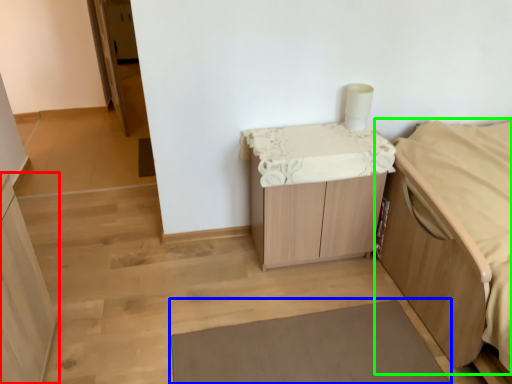
Question: Which object is the farthest from cabinetry (highlighted by a red box)? Choose among these: bath mat (highlighted by a blue box) or furniture (highlighted by a green box).

Choices:
 (A) bath mat
 (B) furniture

Answer: (B)